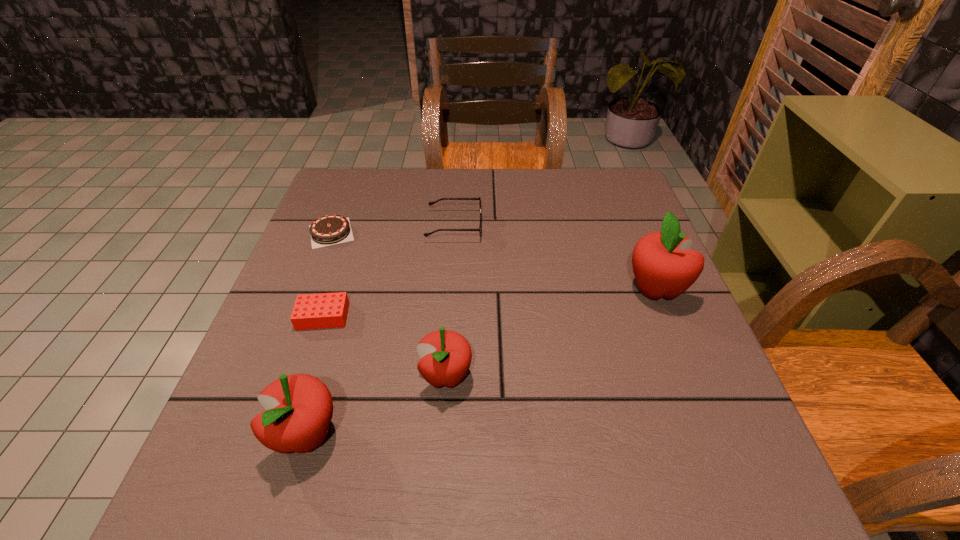
Find the location of a particular element. This screenshot has height=540, width=960. the second shortest apple is located at coordinates (299, 408).

The width and height of the screenshot is (960, 540). In order to click on the fifth shortest object in this screenshot , I will do `click(299, 408)`.

Locate an element on the screen. This screenshot has height=540, width=960. the shortest apple is located at coordinates (446, 355).

The image size is (960, 540). In order to click on the fourth shortest object in this screenshot , I will do `click(446, 355)`.

I want to click on the farthest apple, so click(x=664, y=266).

Locate an element on the screen. This screenshot has width=960, height=540. the rightmost object is located at coordinates point(664,266).

Image resolution: width=960 pixels, height=540 pixels. I want to click on chocolate cake, so click(x=328, y=230).

The image size is (960, 540). Identify the location of sunglasses. (469, 198).

I want to click on Lego, so click(327, 310).

At what (x,y) coordinates should I click in order to perform the action: click on vacant area located on the back of the second tallest apple. Please return your answer as a coordinate pair (x, y). Looking at the image, I should click on (355, 271).